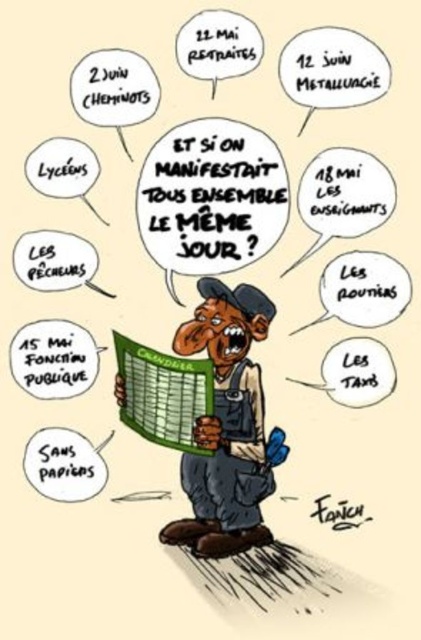
Question: Among these objects, which one is farthest from the camera?

Choices:
 (A) matte overalls at center
 (B) dark blue overalls at center

Answer: (B)

Question: Is the position of matte overalls at center less distant than that of dark blue overalls at center?

Choices:
 (A) yes
 (B) no

Answer: (A)

Question: Does matte overalls at center have a lesser width compared to dark blue overalls at center?

Choices:
 (A) yes
 (B) no

Answer: (B)

Question: Does matte overalls at center have a larger size compared to dark blue overalls at center?

Choices:
 (A) yes
 (B) no

Answer: (A)